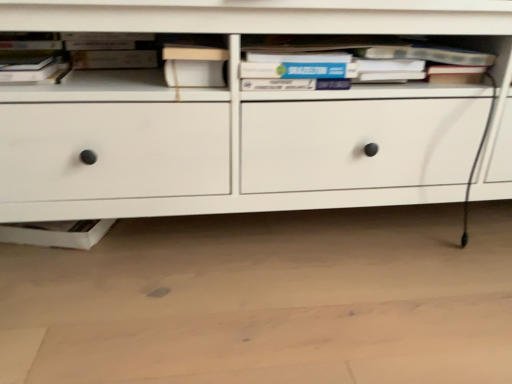
Locate an element on the screen. This screenshot has width=512, height=384. hardcover book at center, which ranks as the 1th book in right-to-left order is located at coordinates (370, 61).

In order to face hardcover book at upper left, the 2th book in the right-to-left sequence, should I rotate leftwards or rightwards?

You should rotate left by 30.918 degrees.

Describe the element at coordinates (28, 67) in the screenshot. The height and width of the screenshot is (384, 512). I see `hardcover book at upper left, which is the first book in left-to-right order` at that location.

The height and width of the screenshot is (384, 512). Find the location of `white matte chest of drawers at center`. white matte chest of drawers at center is located at coordinates (253, 118).

Measure the distance between point [121,100] and camera.

The distance of point [121,100] from camera is 32.13 inches.

Locate an element on the screen. The image size is (512, 384). hardcover book at center, which ranks as the 1th book in right-to-left order is located at coordinates (370, 61).

Does white matte chest of drawers at center have a greater width compared to matte black book at upper left?

Correct, the width of white matte chest of drawers at center exceeds that of matte black book at upper left.

Considering the positions of objects white matte chest of drawers at center and matte black book at upper left in the image provided, who is in front, white matte chest of drawers at center or matte black book at upper left?

white matte chest of drawers at center.

Is white matte chest of drawers at center looking in the opposite direction of matte black book at upper left?

Yes, white matte chest of drawers at center is positioned with its back facing matte black book at upper left.

From the image's perspective, relative to matte black book at upper left, is hardcover book at upper left, which is the first book in left-to-right order, above or below?

From the image's perspective, hardcover book at upper left, which is the first book in left-to-right order, appears below matte black book at upper left.

Is hardcover book at upper left, the 2th book in the right-to-left sequence, beside matte black book at upper left?

No, hardcover book at upper left, the 2th book in the right-to-left sequence, is not next to matte black book at upper left.

In terms of height, does hardcover book at upper left, which is the first book in left-to-right order, look taller or shorter compared to matte black book at upper left?

In the image, hardcover book at upper left, which is the first book in left-to-right order, appears to be taller than matte black book at upper left.

Considering the positions of objects hardcover book at upper left, the 2th book in the right-to-left sequence, and matte black book at upper left in the image provided, who is more to the right, hardcover book at upper left, the 2th book in the right-to-left sequence, or matte black book at upper left?

matte black book at upper left.

From a real-world perspective, is hardcover book at upper left, the 2th book in the right-to-left sequence, on white matte chest of drawers at center?

Indeed, from a real-world perspective, hardcover book at upper left, the 2th book in the right-to-left sequence, stands above white matte chest of drawers at center.

Looking at this image, considering the relative sizes of hardcover book at upper left, which is the first book in left-to-right order, and white matte chest of drawers at center in the image provided, is hardcover book at upper left, which is the first book in left-to-right order, wider than white matte chest of drawers at center?

In fact, hardcover book at upper left, which is the first book in left-to-right order, might be narrower than white matte chest of drawers at center.

Is hardcover book at upper left, the 2th book in the right-to-left sequence, aimed at white matte chest of drawers at center?

Yes, hardcover book at upper left, the 2th book in the right-to-left sequence, is turned towards white matte chest of drawers at center.

Are matte black book at upper left and white matte chest of drawers at center making contact?

matte black book at upper left is not next to white matte chest of drawers at center, and they're not touching.

In the image, is matte black book at upper left positioned in front of or behind white matte chest of drawers at center?

matte black book at upper left is behind white matte chest of drawers at center.

Is point (154, 59) positioned behind point (123, 166)?

That is True.

From a real-world perspective, does matte black book at upper left sit lower than hardcover book at upper left, the 2th book in the right-to-left sequence?

Yes.

In terms of height, does matte black book at upper left look taller or shorter compared to hardcover book at upper left, which is the first book in left-to-right order?

Considering their sizes, matte black book at upper left has less height than hardcover book at upper left, which is the first book in left-to-right order.

Is matte black book at upper left beside hardcover book at upper left, the 2th book in the right-to-left sequence?

No, matte black book at upper left is not beside hardcover book at upper left, the 2th book in the right-to-left sequence.

Does matte black book at upper left have a lesser width compared to hardcover book at upper left, which is the first book in left-to-right order?

Yes, matte black book at upper left is thinner than hardcover book at upper left, which is the first book in left-to-right order.

Does hardcover book at center, marked as the 2th book in a left-to-right arrangement, appear on the right side of matte black book at upper left?

Yes, hardcover book at center, marked as the 2th book in a left-to-right arrangement, is to the right of matte black book at upper left.

Is hardcover book at center, which ranks as the 1th book in right-to-left order, not close to matte black book at upper left?

They are positioned close to each other.

Can you tell me how much hardcover book at center, marked as the 2th book in a left-to-right arrangement, and matte black book at upper left differ in facing direction?

They differ by 1.32 degrees in their facing directions.

Between hardcover book at center, which ranks as the 1th book in right-to-left order, and matte black book at upper left, which one has smaller size?

With smaller size is matte black book at upper left.

Does white matte chest of drawers at center turn towards hardcover book at upper left, which is the first book in left-to-right order?

Yes, white matte chest of drawers at center is turned towards hardcover book at upper left, which is the first book in left-to-right order.

Where is `book that is the 1st one above the white matte chest of drawers at center (from a real-world perspective)`? The width and height of the screenshot is (512, 384). book that is the 1st one above the white matte chest of drawers at center (from a real-world perspective) is located at coordinates (28, 67).

Can you confirm if white matte chest of drawers at center is shorter than hardcover book at upper left, which is the first book in left-to-right order?

In fact, white matte chest of drawers at center may be taller than hardcover book at upper left, which is the first book in left-to-right order.

Is point (360, 158) closer to camera compared to point (47, 68)?

No.

The image size is (512, 384). What are the coordinates of `paperback book behind the white matte chest of drawers at center` in the screenshot? It's located at (113, 59).

The image size is (512, 384). I want to click on book that is the 1st object above the matte black book at upper left (from a real-world perspective), so click(28, 67).

Consider the image. From the image, which object appears to be nearer to white matte chest of drawers at center, matte black book at upper left or hardcover book at upper left, which is the first book in left-to-right order?

matte black book at upper left is closer to white matte chest of drawers at center.

Looking at the image, which one is located closer to matte black book at upper left, hardcover book at center, marked as the 2th book in a left-to-right arrangement, or hardcover book at upper left, which is the first book in left-to-right order?

hardcover book at upper left, which is the first book in left-to-right order.

When comparing their distances from hardcover book at center, marked as the 2th book in a left-to-right arrangement, does matte black book at upper left or white matte chest of drawers at center seem closer?

The object closer to hardcover book at center, marked as the 2th book in a left-to-right arrangement, is white matte chest of drawers at center.

Estimate the real-world distances between objects in this image. Which object is further from matte black book at upper left, hardcover book at center, which ranks as the 1th book in right-to-left order, or white matte chest of drawers at center?

hardcover book at center, which ranks as the 1th book in right-to-left order, lies further to matte black book at upper left than the other object.

Based on their spatial positions, is matte black book at upper left or hardcover book at center, which ranks as the 1th book in right-to-left order, further from white matte chest of drawers at center?

matte black book at upper left is further to white matte chest of drawers at center.

Which object lies further to the anchor point white matte chest of drawers at center, hardcover book at center, marked as the 2th book in a left-to-right arrangement, or hardcover book at upper left, which is the first book in left-to-right order?

hardcover book at upper left, which is the first book in left-to-right order, is positioned further to the anchor white matte chest of drawers at center.

Considering their positions, is hardcover book at upper left, which is the first book in left-to-right order, positioned further to matte black book at upper left than white matte chest of drawers at center?

white matte chest of drawers at center lies further to matte black book at upper left than the other object.

When comparing their distances from white matte chest of drawers at center, does hardcover book at upper left, which is the first book in left-to-right order, or hardcover book at center, marked as the 2th book in a left-to-right arrangement, seem further?

hardcover book at upper left, which is the first book in left-to-right order, lies further to white matte chest of drawers at center than the other object.

Identify the location of paperback book between hardcover book at upper left, the 2th book in the right-to-left sequence, and hardcover book at center, marked as the 2th book in a left-to-right arrangement. (113, 59).

Where is `chest of drawers between matte black book at upper left and hardcover book at center, marked as the 2th book in a left-to-right arrangement, in the horizontal direction`? This screenshot has height=384, width=512. chest of drawers between matte black book at upper left and hardcover book at center, marked as the 2th book in a left-to-right arrangement, in the horizontal direction is located at coordinates (253, 118).

This screenshot has height=384, width=512. In order to click on paperback book located between hardcover book at upper left, which is the first book in left-to-right order, and white matte chest of drawers at center in the left-right direction in this screenshot , I will do `click(113, 59)`.

Find the location of a particular element. The height and width of the screenshot is (384, 512). chest of drawers between hardcover book at upper left, the 2th book in the right-to-left sequence, and hardcover book at center, which ranks as the 1th book in right-to-left order, from left to right is located at coordinates (253, 118).